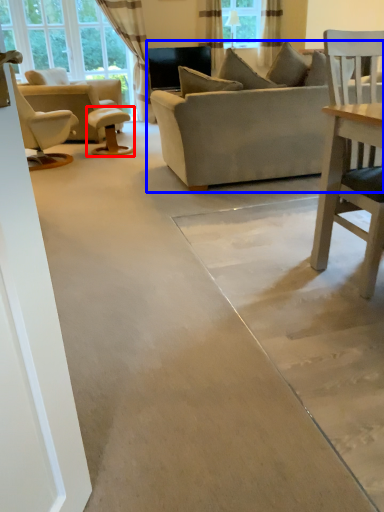
Question: Which object appears closest to the camera in this image, table (highlighted by a red box) or studio couch (highlighted by a blue box)?

Choices:
 (A) table
 (B) studio couch

Answer: (B)